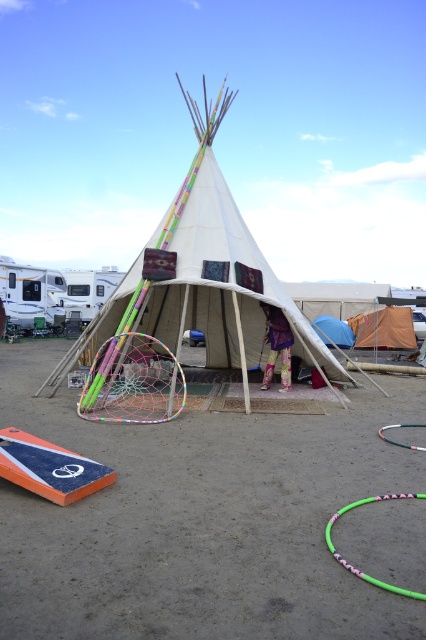
Based on the photo, you are standing at the edge of a dirt field at center and want to throw a frisbee to your friend who is standing 5 meters away from you in the same direction. Can you reach your friend with the frisbee from your current position?

The dirt field at center and viewer are 4.27 meters apart from each other. Since your friend is 5 meters away, you are still 0.73 meters away from reaching them, so you might need to take a few steps forward to ensure the frisbee reaches your friend.

Looking at this image, you are setting up a campsite and need to place a tent and a hula hoop. The white canvas teepee at center and the multicolored netting hula hoop at center are already in the scene. According to the image, which object is located to the right of the other?

The white canvas teepee at center is positioned on the right side of multicolored netting hula hoop at center, so the white canvas teepee at center is to the right of the multicolored netting hula hoop at center.